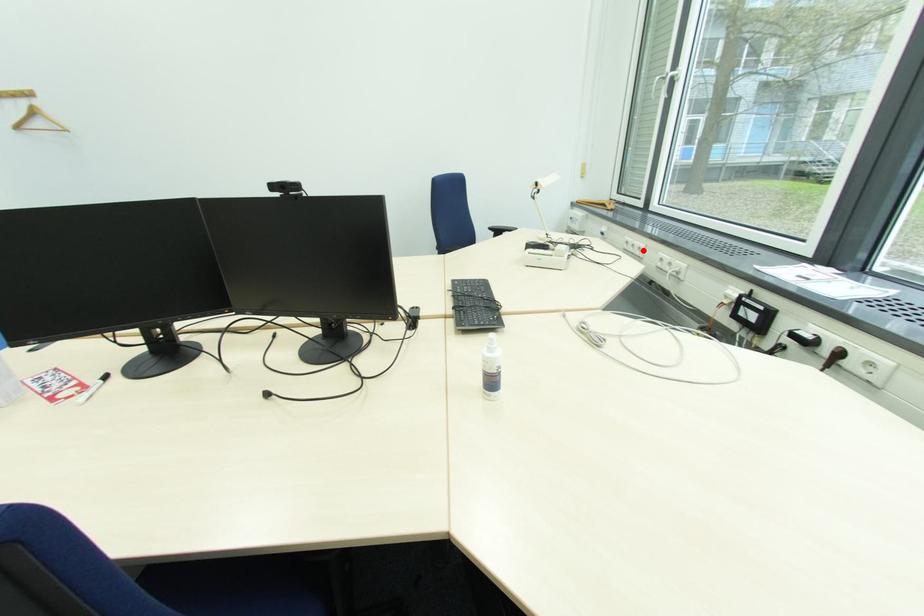
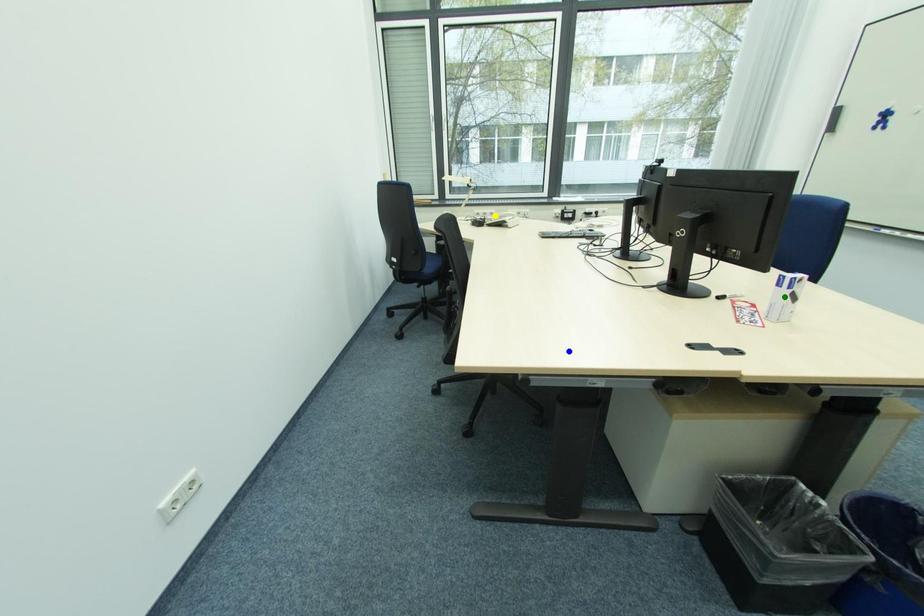
Question: I am providing you with two images of the same scene from different viewpoints. A red point is marked on the first image. You are given multiple points on the second image. Which spot in image 2 lines up with the point in image 1?

Choices:
 (A) yellow point
 (B) blue point
 (C) green point

Answer: (A)